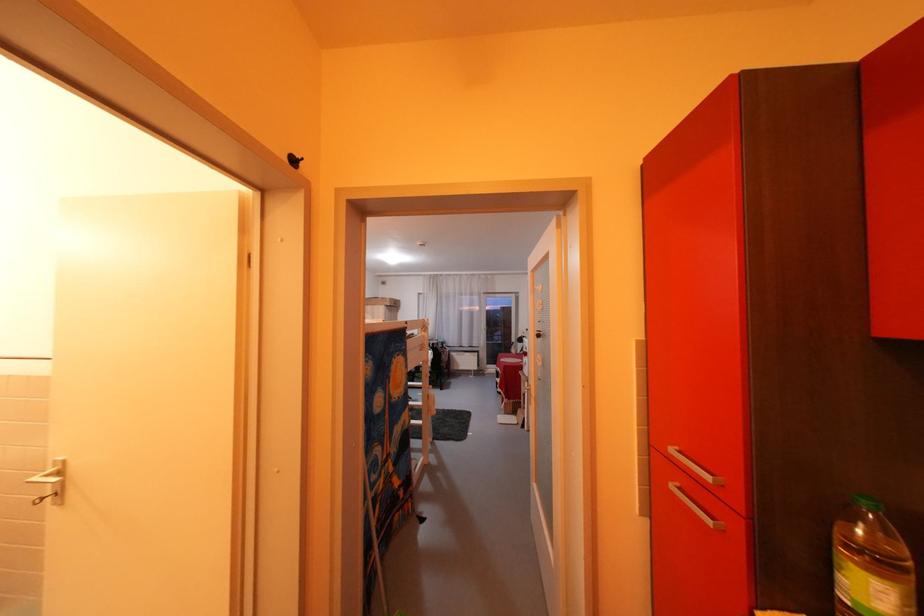
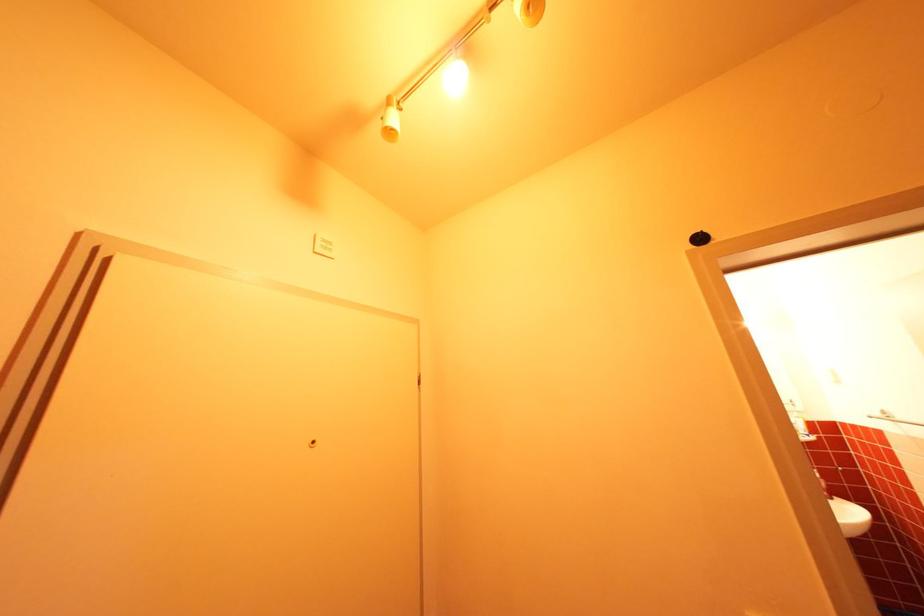
The first image is from the beginning of the video and the second image is from the end. How did the camera likely rotate when shooting the video?

The rotation direction of the camera is left-up.